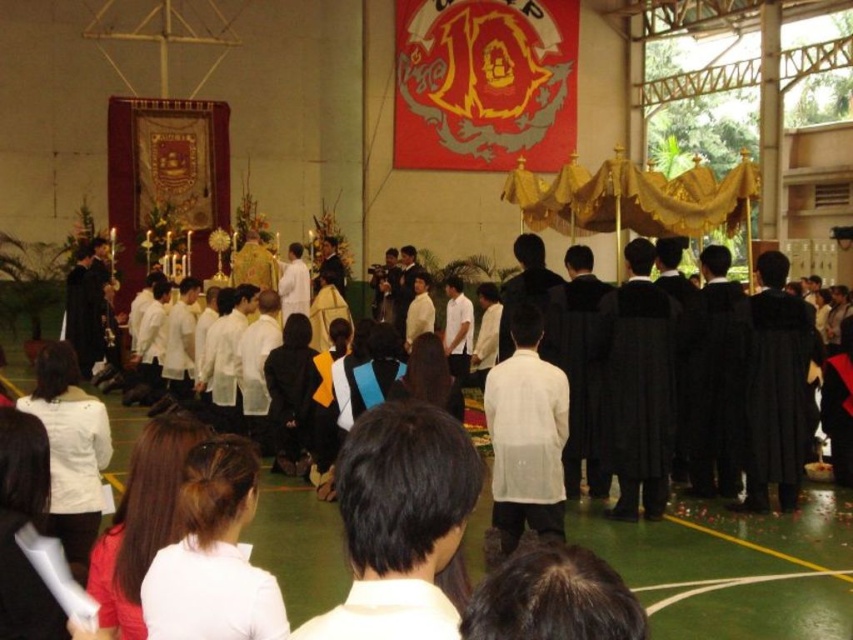
You are a photographer at the event and need to capture a clear photo of both the white matte shirt at lower center and the white matte shirt at center. Which shirt should you focus on first to ensure it appears larger in the photo?

The white matte shirt at lower center should be focused on first because it has a greater height compared to the white matte shirt at center, making it appear larger in the photo.

You are standing at the point marked as point (x=210, y=593) in the image. What object are you currently standing on?

You are standing on the white matte shirt at lower center.

You are standing at the back of the hall and want to walk towards the stage. There are two points marked on the floor in front of you. Which point, point (173, 637) or point (347, 600), is closer to you?

Point (173, 637) is closer to you because it is further to the viewer than point (347, 600).